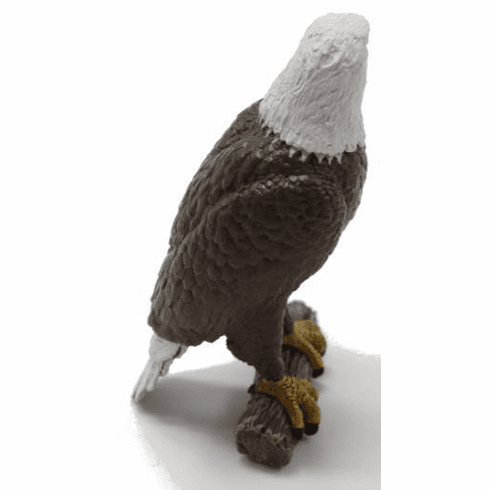
At what (x,y) coordinates should I click in order to perform the action: click on sculpture. Please return your answer as a coordinate pair (x, y). The width and height of the screenshot is (490, 490). Looking at the image, I should click on (274, 250).